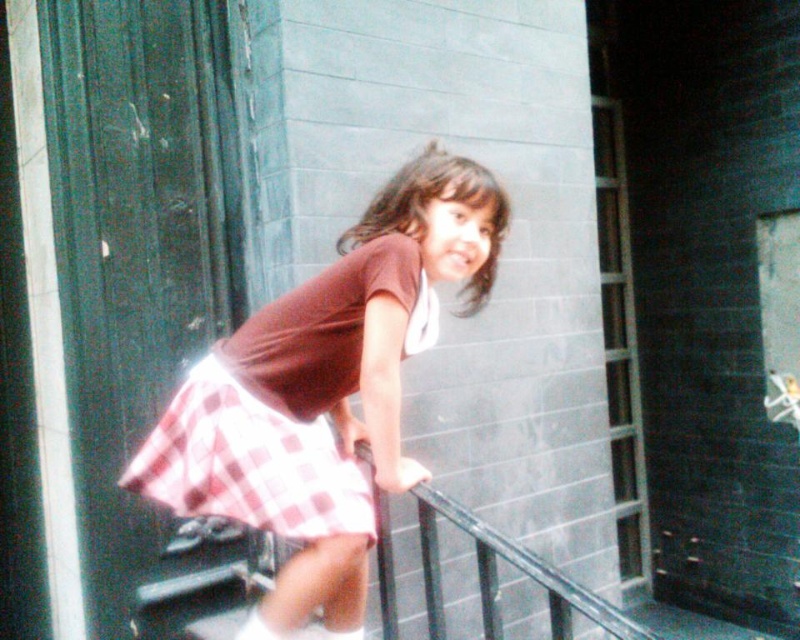
You are a photographer trying to capture a closeup shot of the pink checkered skirt at center. You want to ensure the subject is in focus. What is the minimum distance you should set your camera lens to?

The minimum distance you should set your camera lens is 4.35 feet to ensure the pink checkered skirt at center is in focus since it is 4.35 feet away from the viewer.

From the picture: The girl is wearing two skirts, a pink checkered skirt at center and a red checkered skirt at center. Which one is more to the right?

The pink checkered skirt at center is more to the right.

The young girl is wearing two skirts. The pink checkered skirt at center and the red checkered skirt at center. Which skirt is visible on top?

The pink checkered skirt at center is positioned over the red checkered skirt at center, so the pink one is visible on top.